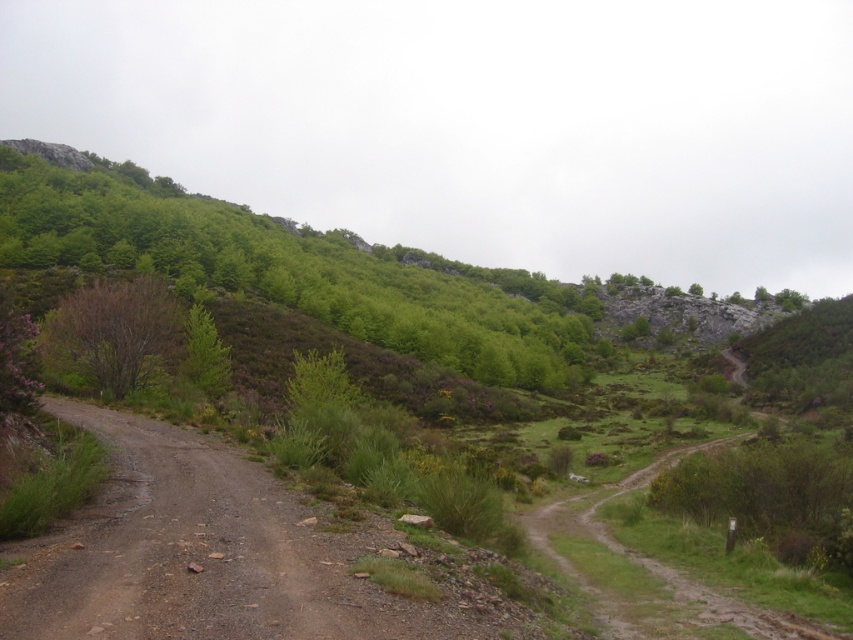
You are a hiker trying to navigate the muddy road in the rural landscape. You notice the green leafy tree at upper left and the brown leafless tree at left. Which tree is closer to you as you stand on the road?

The green leafy tree at upper left is closer to you because the brown leafless tree at left is behind it, indicating it is farther away.